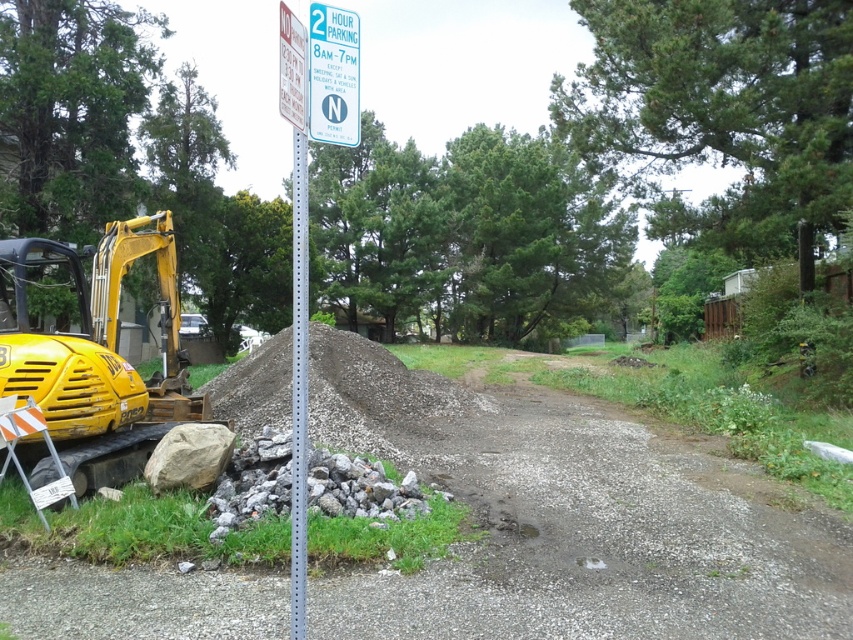
Based on the photo, does gray gravel dirt track at center have a lesser height compared to yellow rubber excavator at lower left?

Yes, gray gravel dirt track at center is shorter than yellow rubber excavator at lower left.

Which is behind, point (846, 572) or point (125, 420)?

Positioned behind is point (125, 420).

Does point (564, 394) lie behind point (161, 312)?

Yes.

In order to click on gray gravel dirt track at center in this screenshot , I will do `click(576, 524)`.

Consider the image. Who is taller, gray gravel dirt track at center or blue plastic sign at upper center?

gray gravel dirt track at center

Between gray gravel dirt track at center and blue plastic sign at upper center, which one appears on the left side from the viewer's perspective?

Positioned to the left is blue plastic sign at upper center.

Which is behind, point (741, 477) or point (317, 83)?

The point (741, 477) is behind.

Image resolution: width=853 pixels, height=640 pixels. Find the location of `gray gravel dirt track at center`. gray gravel dirt track at center is located at coordinates (576, 524).

Does yellow rubber excavator at lower left have a greater height compared to blue plastic sign at upper center?

Yes, yellow rubber excavator at lower left is taller than blue plastic sign at upper center.

Who is more distant from viewer, (194, 419) or (329, 13)?

The point (194, 419) is behind.

This screenshot has height=640, width=853. What are the coordinates of `yellow rubber excavator at lower left` in the screenshot? It's located at (93, 349).